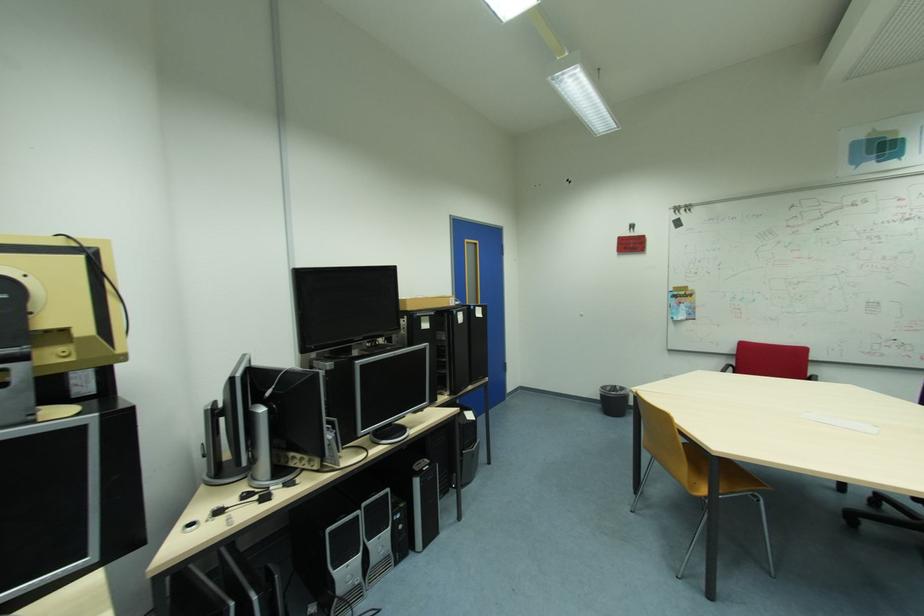
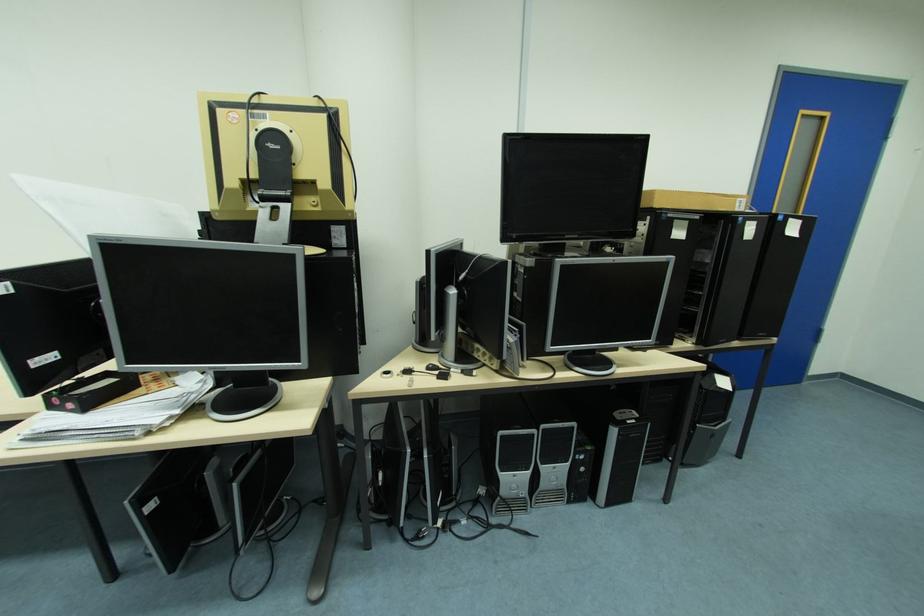
Find the pixel in the second image that matches (x=63, y=358) in the first image.

(315, 205)